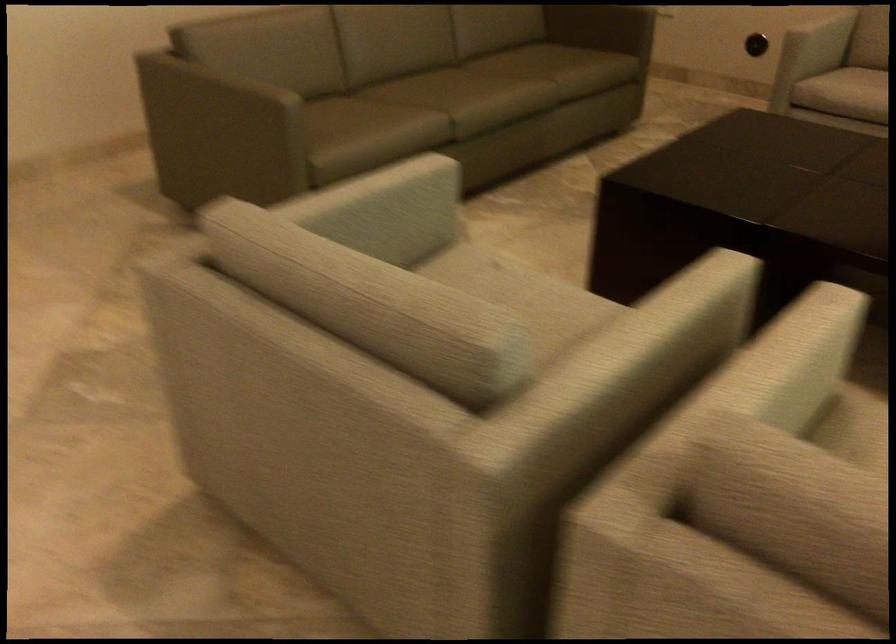
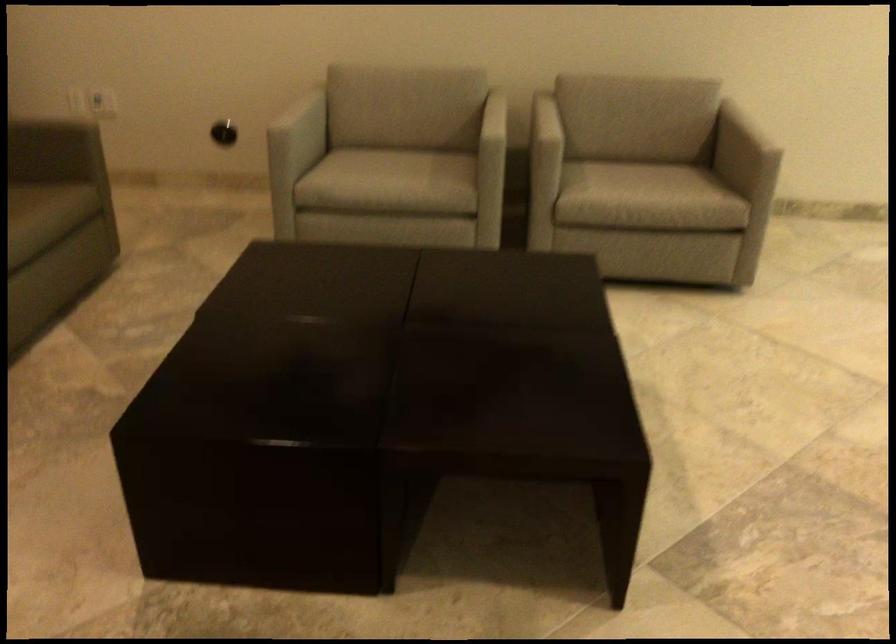
Question: The camera is either moving clockwise (left) or counter-clockwise (right) around the object. The first image is from the beginning of the video and the second image is from the end. Is the camera moving left or right when shooting the video?

Choices:
 (A) Left
 (B) Right

Answer: (A)